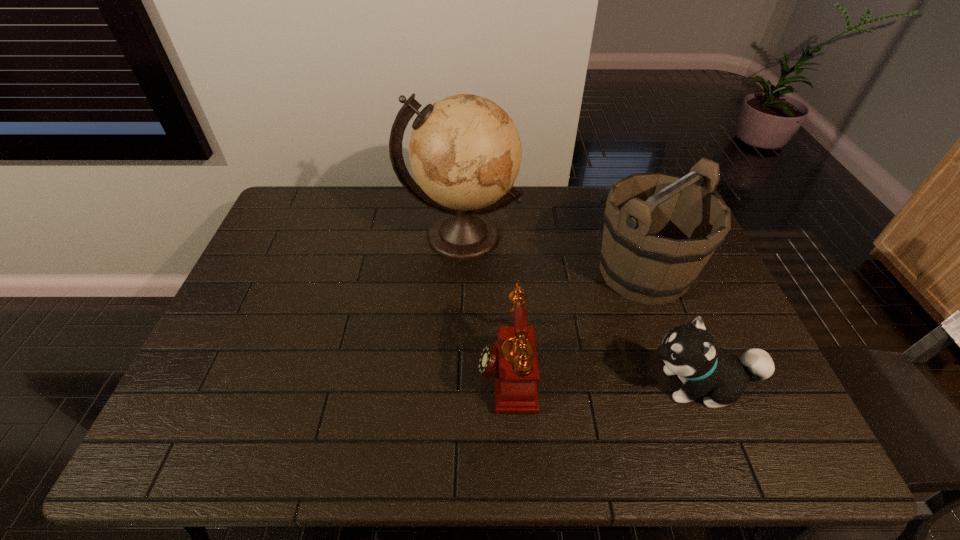
At what (x,y) coordinates should I click in order to perform the action: click on empty space that is in between the puppy and the globe. Please return your answer as a coordinate pair (x, y). Looking at the image, I should click on (580, 310).

Locate an element on the screen. The width and height of the screenshot is (960, 540). vacant area that lies between the second tallest object and the telephone is located at coordinates (575, 320).

This screenshot has width=960, height=540. I want to click on empty space that is in between the puppy and the telephone, so click(x=603, y=377).

The width and height of the screenshot is (960, 540). What are the coordinates of `free space that is in between the bucket and the puppy` in the screenshot? It's located at (671, 328).

Locate an element on the screen. Image resolution: width=960 pixels, height=540 pixels. vacant space that's between the puppy and the third shortest object is located at coordinates (671, 328).

Identify the location of free point between the tallest object and the telephone. The width and height of the screenshot is (960, 540). (484, 302).

Where is `empty space that is in between the globe and the puppy`? The width and height of the screenshot is (960, 540). empty space that is in between the globe and the puppy is located at coordinates (580, 310).

Point out which object is positioned as the nearest to the globe. Please provide its 2D coordinates. Your answer should be formatted as a tuple, i.e. [(x, y)], where the tuple contains the x and y coordinates of a point satisfying the conditions above.

[(660, 230)]

Choose which object is the second nearest neighbor to the bucket. Please provide its 2D coordinates. Your answer should be formatted as a tuple, i.e. [(x, y)], where the tuple contains the x and y coordinates of a point satisfying the conditions above.

[(513, 359)]

The height and width of the screenshot is (540, 960). I want to click on free location that satisfies the following two spatial constraints: 1. on the front-facing side of the globe; 2. on the right side of the third shortest object, so click(x=460, y=272).